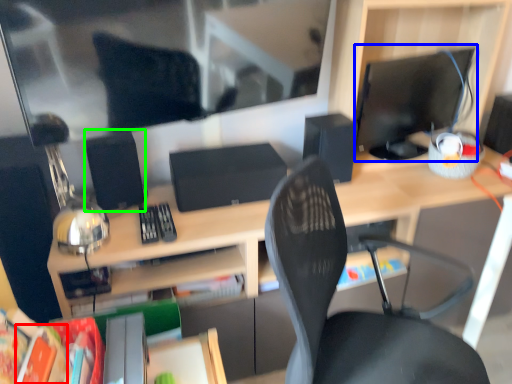
Question: Which object is the closest to the paperback book (highlighted by a red box)? Choose among these: computer monitor (highlighted by a blue box) or speaker (highlighted by a green box).

Choices:
 (A) computer monitor
 (B) speaker

Answer: (B)